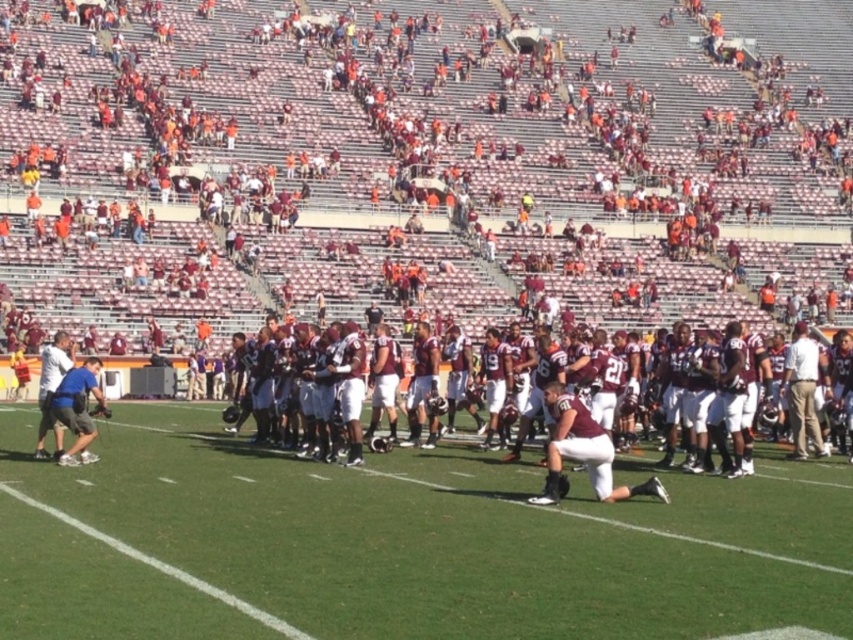
Question: Is white smooth grass at center above maroon jersey at center?

Choices:
 (A) no
 (B) yes

Answer: (A)

Question: Which of the following is the closest to the observer?

Choices:
 (A) (254, 550)
 (B) (462, 468)

Answer: (A)

Question: Is white smooth grass at center positioned before maroon jersey at center?

Choices:
 (A) no
 (B) yes

Answer: (B)

Question: Does white smooth grass at center have a smaller size compared to maroon jersey at center?

Choices:
 (A) no
 (B) yes

Answer: (B)

Question: Which of the following is the closest to the observer?

Choices:
 (A) maroon jersey at center
 (B) white smooth grass at center

Answer: (B)